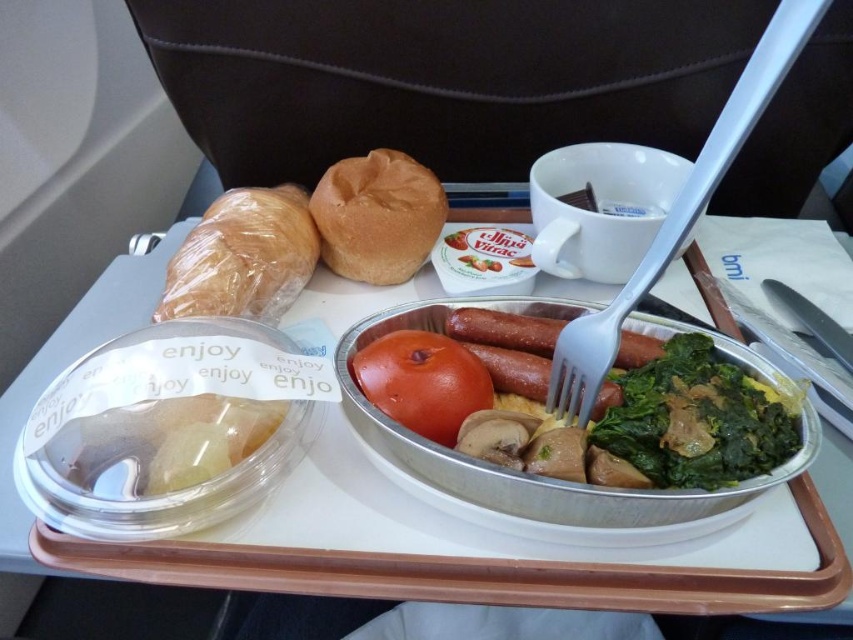
You are a passenger on an airplane and want to reach the point at coordinates point [729,458] on the tray table. Your hand can reach up to 16 inches. Can you reach it?

The distance between point [729,458] and the viewer is 18.01 inches, which is beyond your hand reach of 16 inches. Therefore, you cannot reach it.

You are a passenger on an airplane and want to locate the translucent plastic bread at upper left. According to the coordinates provided, where exactly should you look on the tray?

The translucent plastic bread at upper left is located at point coordinates (242, 257) on the tray.